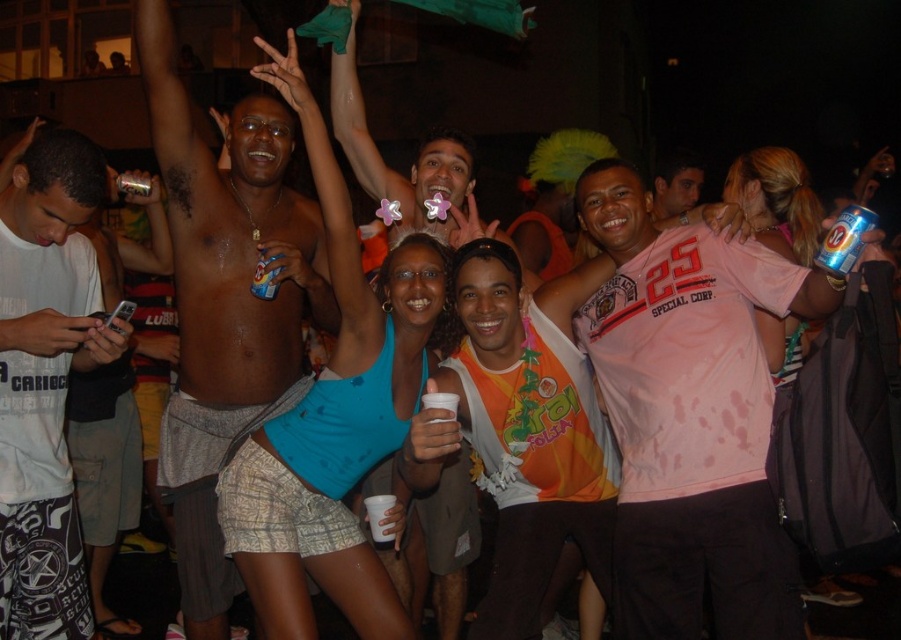
Measure the distance between pink jersey at center and camera.

pink jersey at center and camera are 2.79 meters apart from each other.

Does point (745, 422) lie behind point (281, 355)?

No, (745, 422) is in front of (281, 355).

Where is `pink jersey at center`? pink jersey at center is located at coordinates (690, 413).

Which of these two, shiny metallic shorts at center or blue fabric tank top at center, stands taller?

shiny metallic shorts at center

Does point (179, 570) come farther from viewer compared to point (410, 328)?

That is True.

At what (x,y) coordinates should I click in order to perform the action: click on shiny metallic shorts at center. Please return your answer as a coordinate pair (x, y). This screenshot has width=901, height=640. Looking at the image, I should click on (225, 301).

Which of these two, blue fabric tank top at center or matte pink shirt at center, stands shorter?

blue fabric tank top at center

Is blue fabric tank top at center below matte pink shirt at center?

Yes.

Who is more forward, (394, 429) or (690, 156)?

Point (394, 429) is more forward.

This screenshot has height=640, width=901. Find the location of `blue fabric tank top at center`. blue fabric tank top at center is located at coordinates (333, 417).